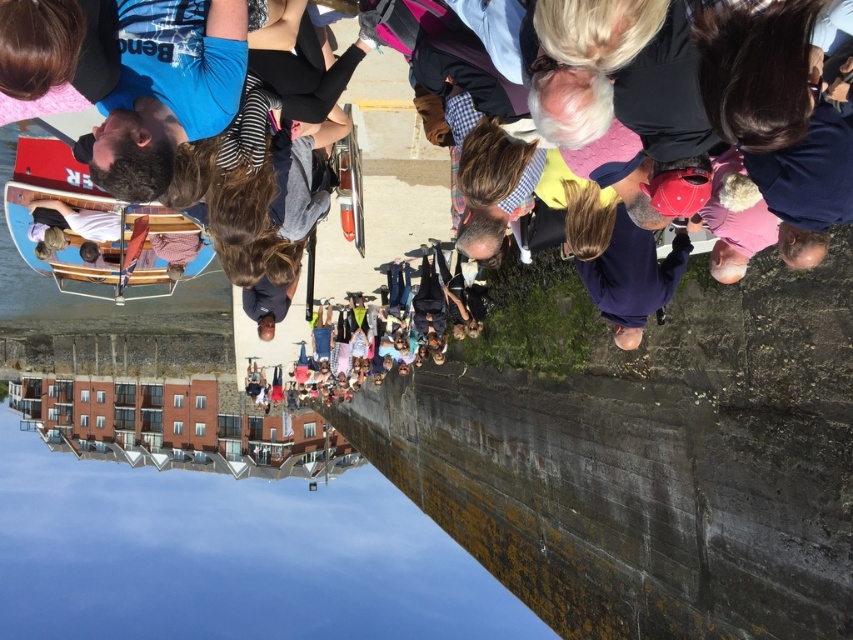
Is point (27, 152) positioned after point (280, 368)?

No, (27, 152) is closer to viewer.

Identify the location of red wood boat at left. (73, 209).

You are a GUI agent. You are given a task and a screenshot of the screen. Output one action in this format:
    pyautogui.click(x=<x>, y=<y>)
    Task: Click on the red wood boat at left
    Image resolution: width=853 pixels, height=640 pixels.
    Given the screenshot: What is the action you would take?
    pyautogui.click(x=73, y=209)

Describe the element at coordinates (448, 312) in the screenshot. I see `multicolored casual clothing at center` at that location.

Which is in front, point (372, 324) or point (142, 230)?

Point (142, 230)

Between point (360, 320) and point (134, 241), which one is positioned in front?

Point (134, 241) is in front.

Find the location of a particular element. multicolored casual clothing at center is located at coordinates (448, 312).

Is smooth concrete waterway at lower left taller than multicolored casual clothing at center?

Correct, smooth concrete waterway at lower left is much taller as multicolored casual clothing at center.

Between point (343, 502) and point (375, 333), which one is positioned behind?

Positioned behind is point (343, 502).

This screenshot has width=853, height=640. In order to click on smooth concrete waterway at lower left in this screenshot , I will do (x=228, y=556).